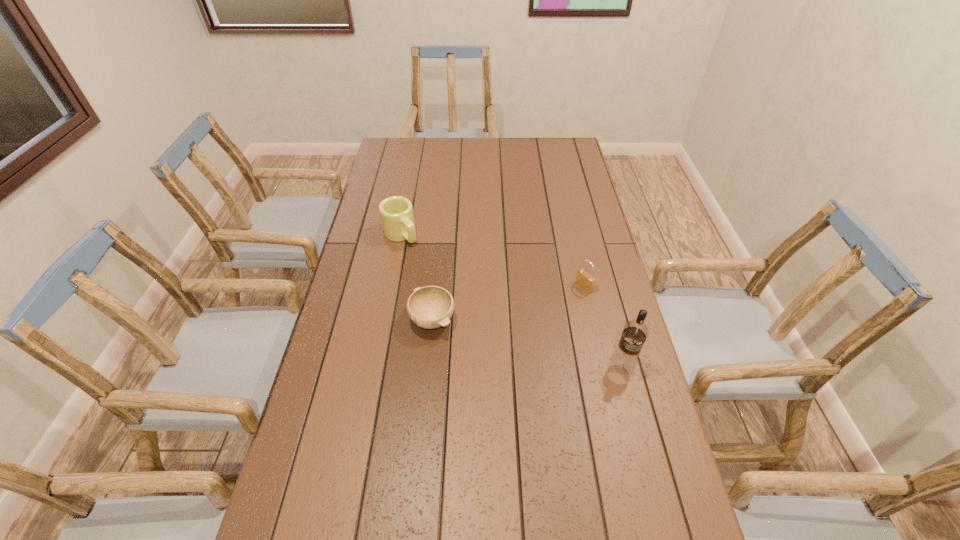
At what (x,y) coordinates should I click in order to perform the action: click on free space on the desktop that is between the third object from right to left and the nearest object and is positioned with the handle on the side of the leftmost object. Please return your answer as a coordinate pair (x, y). The width and height of the screenshot is (960, 540). Looking at the image, I should click on (498, 335).

This screenshot has height=540, width=960. Find the location of `free space on the desktop that is between the bowl and the tallest object and is positioned on the front-facing side of the padlock`. free space on the desktop that is between the bowl and the tallest object and is positioned on the front-facing side of the padlock is located at coordinates (501, 336).